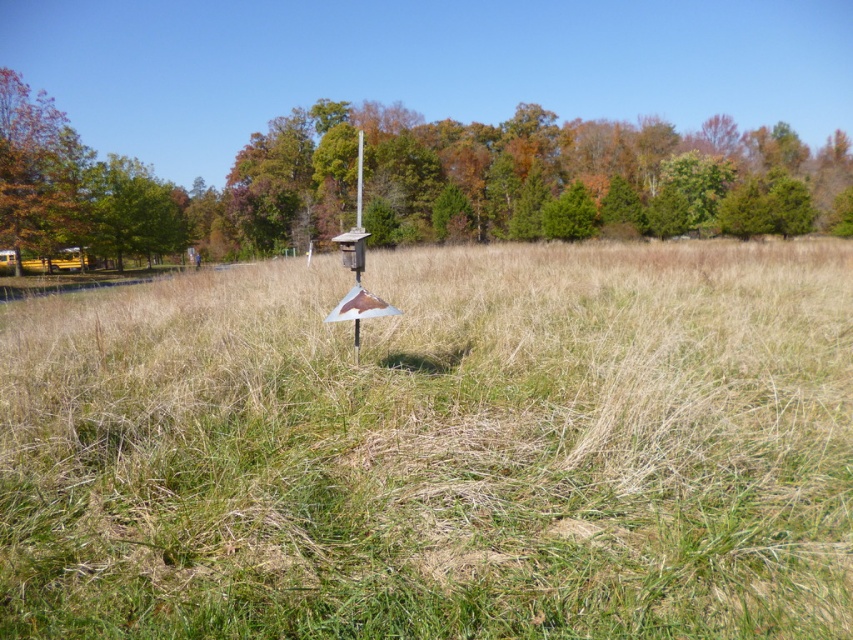
Question: Can you confirm if metallic silver sign at center is bigger than green matte tree at upper center?

Choices:
 (A) yes
 (B) no

Answer: (B)

Question: Which point is farther to the camera?

Choices:
 (A) (297, 154)
 (B) (619, 413)

Answer: (A)

Question: Can you confirm if metallic silver sign at center is positioned to the right of green matte tree at upper center?

Choices:
 (A) yes
 (B) no

Answer: (B)

Question: Does metallic silver sign at center lie behind green matte tree at upper center?

Choices:
 (A) no
 (B) yes

Answer: (A)

Question: Which point appears closest to the camera in this image?

Choices:
 (A) (488, 506)
 (B) (288, 186)

Answer: (A)